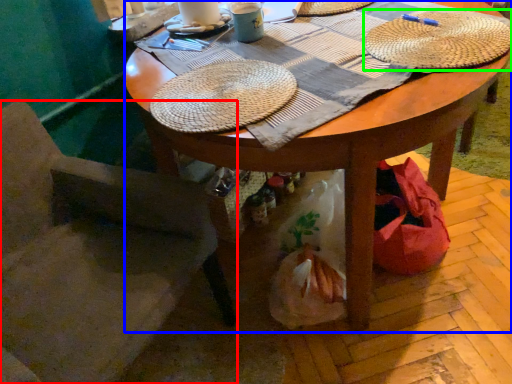
Question: Which is farther away from chair (highlighted by a red box)? desk (highlighted by a blue box) or hat (highlighted by a green box)?

Choices:
 (A) desk
 (B) hat

Answer: (B)